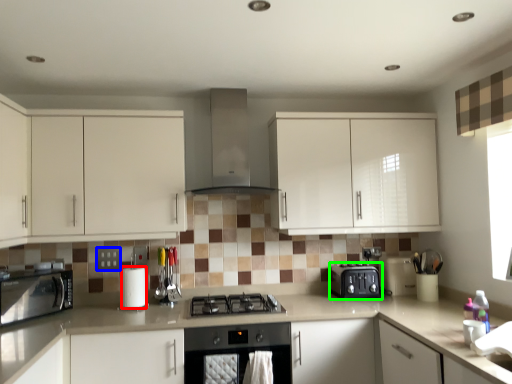
Question: Based on their relative distances, which object is farther from paper towel (highlighted by a red box)? Choose from square (highlighted by a blue box) and kitchen appliance (highlighted by a green box).

Choices:
 (A) square
 (B) kitchen appliance

Answer: (B)